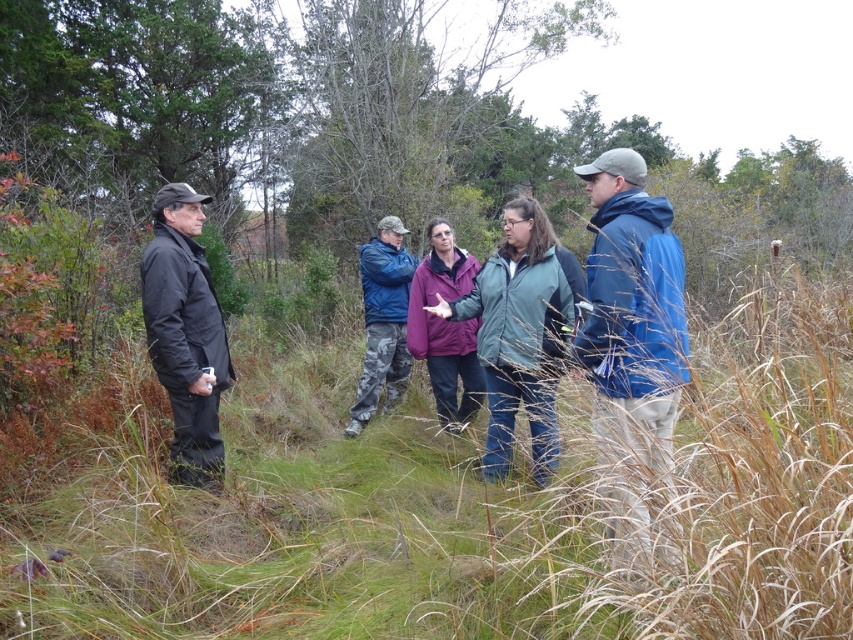
Question: Does purple fleece jacket at center come behind camo pants at center?

Choices:
 (A) no
 (B) yes

Answer: (A)

Question: Which is farther from the black matte jacket at left?

Choices:
 (A) brown dry grass at center
 (B) blue fabric jacket at right
 (C) purple fleece jacket at center

Answer: (A)

Question: Which object appears closest to the camera in this image?

Choices:
 (A) matte purple jacket at center
 (B) purple fleece jacket at center
 (C) camo pants at center
 (D) brown dry grass at center

Answer: (D)

Question: Does matte purple jacket at center appear on the right side of purple fleece jacket at center?

Choices:
 (A) no
 (B) yes

Answer: (B)

Question: Which of the following is the closest to the observer?

Choices:
 (A) camo pants at center
 (B) purple fleece jacket at center
 (C) blue fabric jacket at right
 (D) matte purple jacket at center

Answer: (C)

Question: From the image, what is the correct spatial relationship of brown dry grass at center in relation to camo pants at center?

Choices:
 (A) below
 (B) above

Answer: (A)